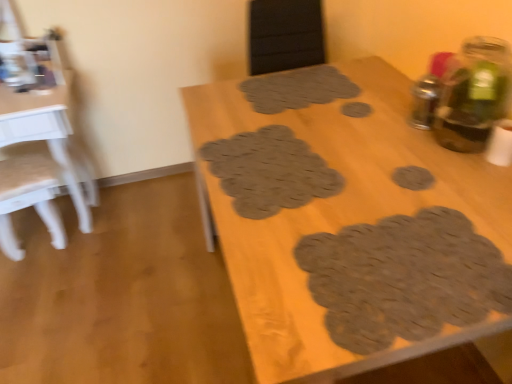
Locate an element on the screen. The image size is (512, 384). free area in between green glass bottle at upper right, acting as the 1th bottle starting from the front, and brown textured mat at center, which appears as the 4th footprint when viewed from the back is located at coordinates (381, 156).